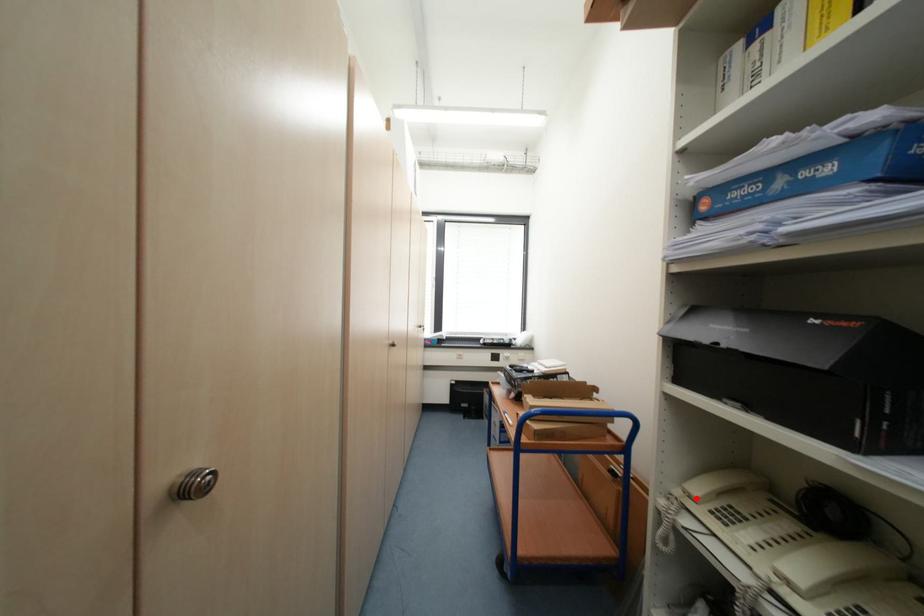
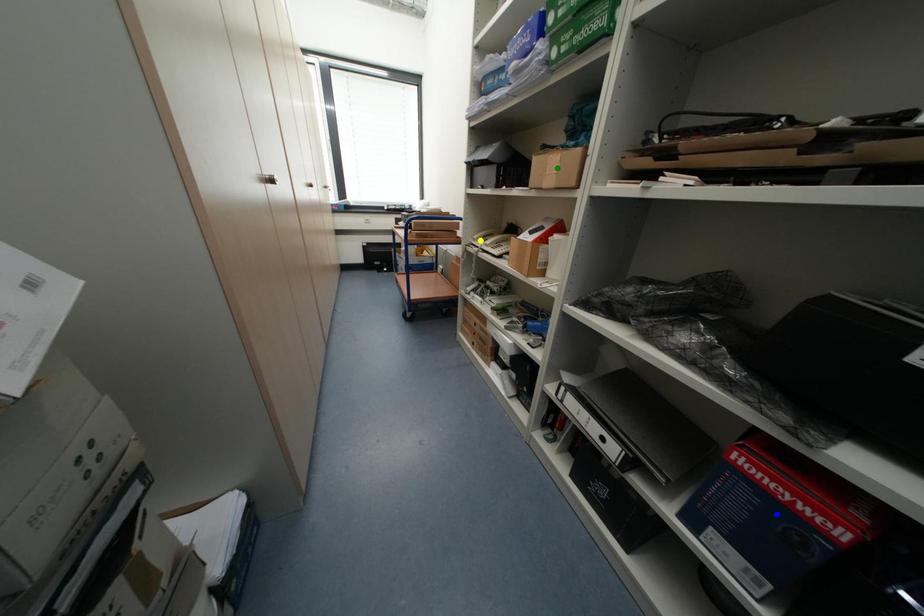
Question: I am providing you with two images of the same scene from different viewpoints. A red point is marked on the first image. You are given multiple points on the second image. Which point in image 2 is actually the same real-world point as the red point in image 1?

Choices:
 (A) yellow point
 (B) green point
 (C) blue point

Answer: (A)